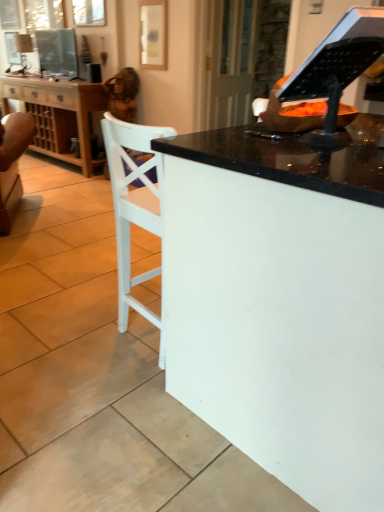
Locate an element on the screen. black plastic music stand at upper right is located at coordinates (330, 70).

Measure the distance between point (58, 159) and camera.

Point (58, 159) is 4.32 meters from camera.

This screenshot has height=512, width=384. Find the location of `wooden cabinet at left`. wooden cabinet at left is located at coordinates (58, 114).

Locate an element on the screen. The width and height of the screenshot is (384, 512). white glossy desk at center is located at coordinates (281, 303).

Identify the location of glass door in front of the matte black tv at upper left. (231, 62).

Is transparent glass door at upper center directly adjacent to matte black tv at upper left?

transparent glass door at upper center and matte black tv at upper left are clearly separated.

Which is behind, transparent glass door at upper center or matte black tv at upper left?

matte black tv at upper left is more distant.

Is transparent glass door at upper center to the left of matte black tv at upper left from the viewer's perspective?

No.

From the image's perspective, between wooden cabinet at left and white glossy desk at center, which one is located above?

wooden cabinet at left is shown above in the image.

Are wooden cabinet at left and white glossy desk at center far apart?

Absolutely, wooden cabinet at left is distant from white glossy desk at center.

Does wooden cabinet at left have a lesser width compared to white glossy desk at center?

Correct, the width of wooden cabinet at left is less than that of white glossy desk at center.

Which of these two, wooden cabinet at left or white glossy desk at center, stands taller?

Standing taller between the two is white glossy desk at center.

Can you confirm if matte black tv at upper left is wider than transparent glass door at upper center?

Yes, matte black tv at upper left is wider than transparent glass door at upper center.

The width and height of the screenshot is (384, 512). Find the location of `television on the left of transparent glass door at upper center`. television on the left of transparent glass door at upper center is located at coordinates (58, 52).

Does matte black tv at upper left appear on the right side of transparent glass door at upper center?

Incorrect, matte black tv at upper left is not on the right side of transparent glass door at upper center.

From the image's perspective, relative to transparent glass door at upper center, is matte black tv at upper left above or below?

Based on their image positions, matte black tv at upper left is located above transparent glass door at upper center.

I want to click on picture frame above the wooden cabinet at left (from the image's perspective), so click(153, 34).

From a real-world perspective, who is located lower, matte wooden picture frame at upper center or wooden cabinet at left?

wooden cabinet at left.

From the picture: Is matte wooden picture frame at upper center next to matte black tv at upper left and touching it?

No, matte wooden picture frame at upper center is not with matte black tv at upper left.

Between matte wooden picture frame at upper center and matte black tv at upper left, which one has more height?

Standing taller between the two is matte wooden picture frame at upper center.

Considering the sizes of objects matte wooden picture frame at upper center and matte black tv at upper left in the image provided, who is bigger, matte wooden picture frame at upper center or matte black tv at upper left?

Bigger between the two is matte black tv at upper left.

How many degrees apart are the facing directions of matte wooden picture frame at upper center and matte black tv at upper left?

They differ by 0.962 degrees in their facing directions.

From a real-world perspective, is matte wooden picture frame at upper center on top of white glossy desk at center?

Correct, in the physical world, matte wooden picture frame at upper center is higher than white glossy desk at center.

From the picture: Is matte wooden picture frame at upper center facing away from white glossy desk at center?

That's not correct — matte wooden picture frame at upper center is not looking away from white glossy desk at center.

Does matte wooden picture frame at upper center lie behind white glossy desk at center?

Yes, it is behind white glossy desk at center.

Is black plastic music stand at upper right thinner than matte wooden picture frame at upper center?

No.

Is the depth of black plastic music stand at upper right greater than that of matte wooden picture frame at upper center?

No, the depth of black plastic music stand at upper right is less than that of matte wooden picture frame at upper center.

Does point (301, 83) come in front of point (159, 30)?

That is True.

Consider the image. Considering the relative positions of black plastic music stand at upper right and matte wooden picture frame at upper center in the image provided, is black plastic music stand at upper right to the right of matte wooden picture frame at upper center from the viewer's perspective?

Indeed, black plastic music stand at upper right is positioned on the right side of matte wooden picture frame at upper center.

This screenshot has width=384, height=512. Find the location of `glass door on the right of the matte black tv at upper left`. glass door on the right of the matte black tv at upper left is located at coordinates (231, 62).

Where is `cabinetry above the white glossy desk at center (from the image's perspective)`? This screenshot has height=512, width=384. cabinetry above the white glossy desk at center (from the image's perspective) is located at coordinates (58, 114).

Looking at the image, which one is located further to transparent glass door at upper center, black plastic music stand at upper right or white glossy desk at center?

Based on the image, white glossy desk at center appears to be further to transparent glass door at upper center.

Which object lies further to the anchor point matte black tv at upper left, white glossy desk at center or wooden cabinet at left?

white glossy desk at center.

Which object lies nearer to the anchor point transparent glass door at upper center, matte wooden picture frame at upper center or black plastic music stand at upper right?

matte wooden picture frame at upper center is positioned closer to the anchor transparent glass door at upper center.

Which object lies further to the anchor point matte black tv at upper left, white glossy desk at center or transparent glass door at upper center?

white glossy desk at center is positioned further to the anchor matte black tv at upper left.

Considering their positions, is matte black tv at upper left positioned further to white glossy desk at center than transparent glass door at upper center?

Among the two, matte black tv at upper left is located further to white glossy desk at center.

Estimate the real-world distances between objects in this image. Which object is closer to black plastic music stand at upper right, white glossy desk at center or transparent glass door at upper center?

Among the two, white glossy desk at center is located nearer to black plastic music stand at upper right.

When comparing their distances from matte black tv at upper left, does transparent glass door at upper center or matte wooden picture frame at upper center seem further?

Among the two, transparent glass door at upper center is located further to matte black tv at upper left.

Estimate the real-world distances between objects in this image. Which object is further from matte black tv at upper left, wooden cabinet at left or transparent glass door at upper center?

transparent glass door at upper center is positioned further to the anchor matte black tv at upper left.

Where is `glass door between black plastic music stand at upper right and wooden cabinet at left in the front-back direction`? The height and width of the screenshot is (512, 384). glass door between black plastic music stand at upper right and wooden cabinet at left in the front-back direction is located at coordinates click(231, 62).

Locate an element on the screen. glass door positioned between white glossy desk at center and matte black tv at upper left from near to far is located at coordinates (231, 62).

Where is `glass door between black plastic music stand at upper right and matte wooden picture frame at upper center in the front-back direction`? The image size is (384, 512). glass door between black plastic music stand at upper right and matte wooden picture frame at upper center in the front-back direction is located at coordinates (231, 62).

Identify the location of picture frame between black plastic music stand at upper right and matte black tv at upper left along the z-axis. (153, 34).